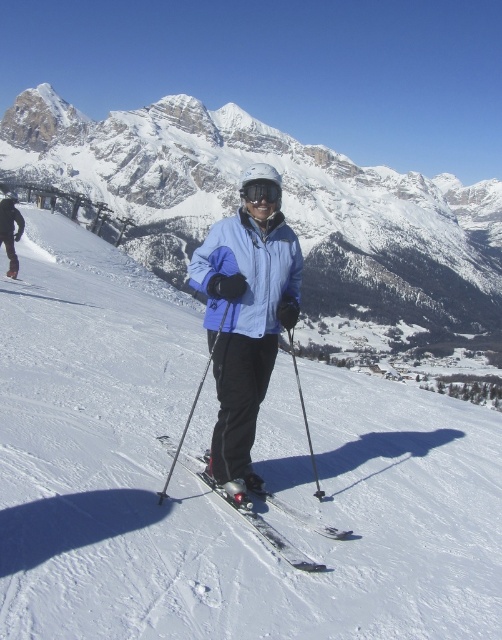
Question: Among these objects, which one is farthest from the camera?

Choices:
 (A) matte blue jacket at center
 (B) black matte jacket at center
 (C) metallic silver skis at center
 (D) white snow ski slope at center

Answer: (B)

Question: Among these objects, which one is farthest from the camera?

Choices:
 (A) matte blue jacket at center
 (B) snowy granite mountain at upper center
 (C) black matte goggles at center

Answer: (B)

Question: In this image, where is matte blue jacket at center located relative to black matte goggles at center?

Choices:
 (A) below
 (B) above

Answer: (A)

Question: Is the position of metallic silver skis at center more distant than that of black matte goggles at center?

Choices:
 (A) no
 (B) yes

Answer: (A)

Question: Among these points, which one is farthest from the camera?

Choices:
 (A) (158, 438)
 (B) (149, 157)

Answer: (B)

Question: Does blue softshell jacket at center appear under black matte goggles at center?

Choices:
 (A) no
 (B) yes

Answer: (A)